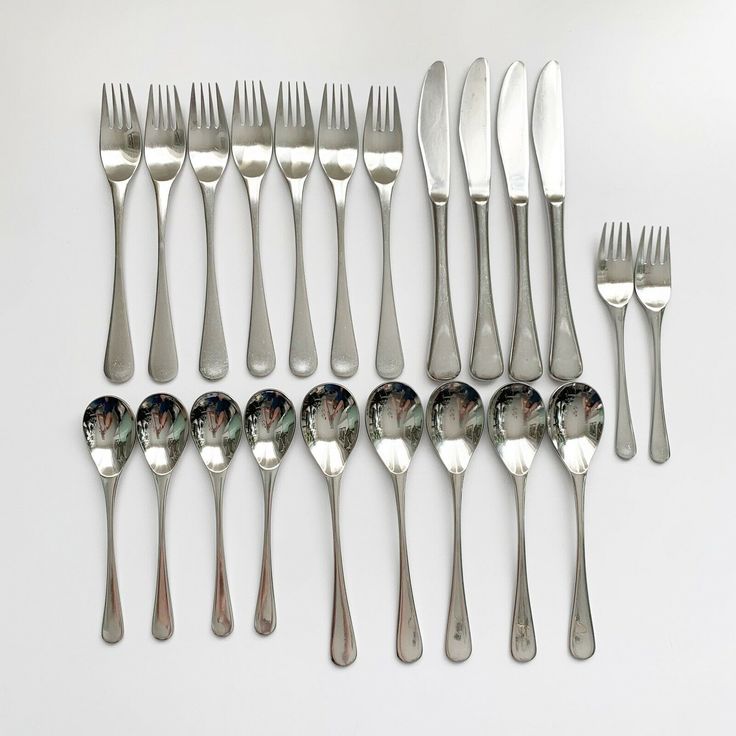
This screenshot has height=736, width=736. In order to click on spoon handles in this screenshot , I will do `click(113, 631)`, `click(160, 629)`, `click(222, 615)`, `click(268, 620)`, `click(343, 651)`, `click(411, 637)`, `click(453, 645)`, `click(523, 644)`, `click(584, 634)`.